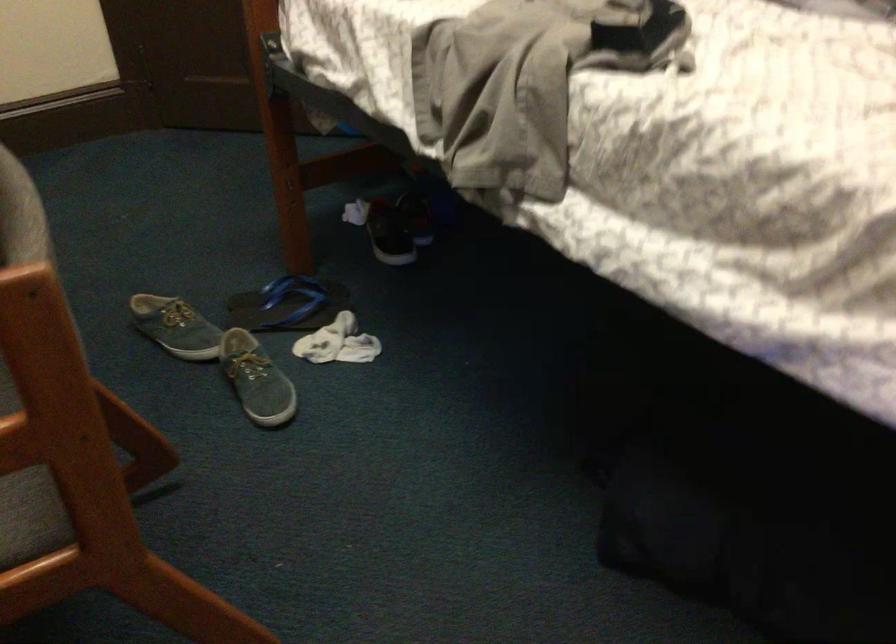
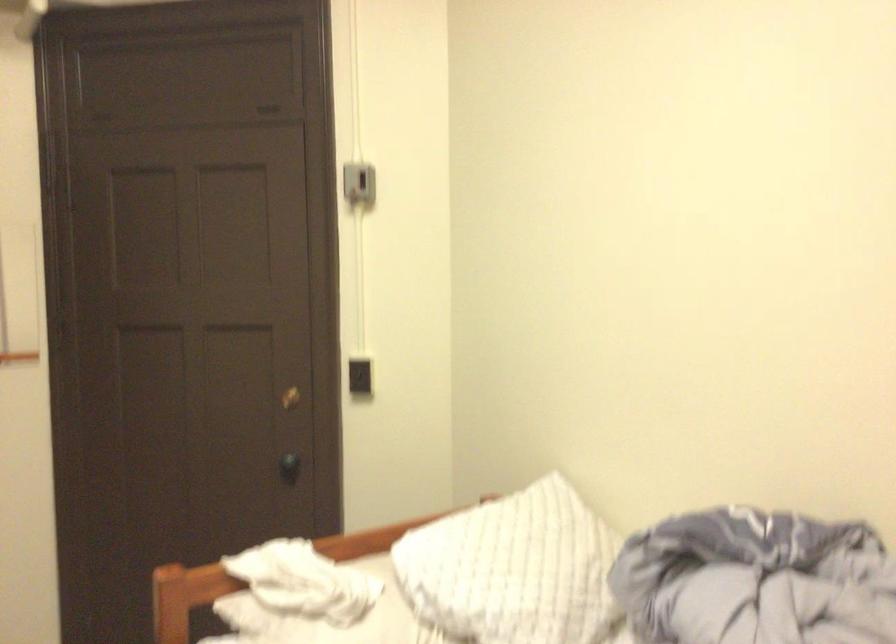
Question: How did the camera likely rotate?

Choices:
 (A) Left
 (B) Right
 (C) Up
 (D) Down

Answer: (C)